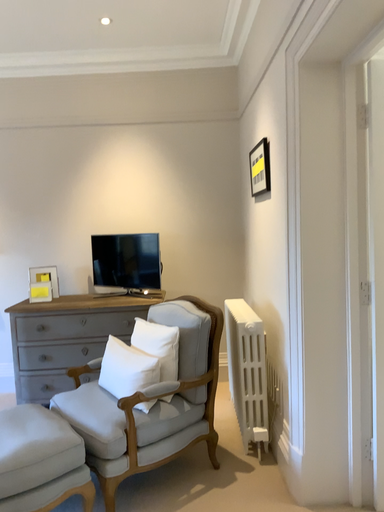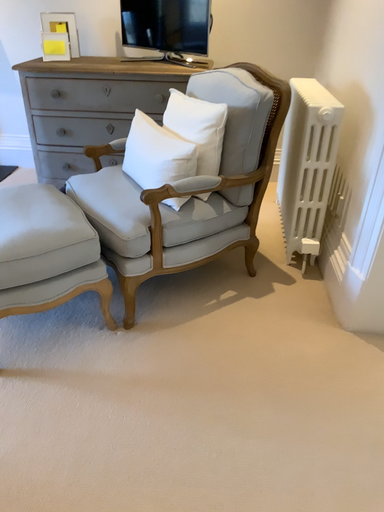
Question: Which way did the camera rotate in the video?

Choices:
 (A) rotated left
 (B) rotated right

Answer: (A)